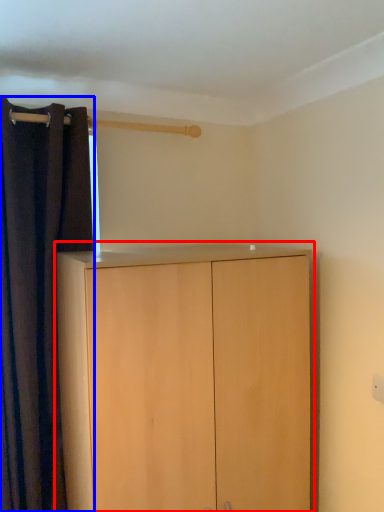
Question: Which of the following is the farthest to the observer, cupboard (highlighted by a red box) or curtain (highlighted by a blue box)?

Choices:
 (A) cupboard
 (B) curtain

Answer: (B)